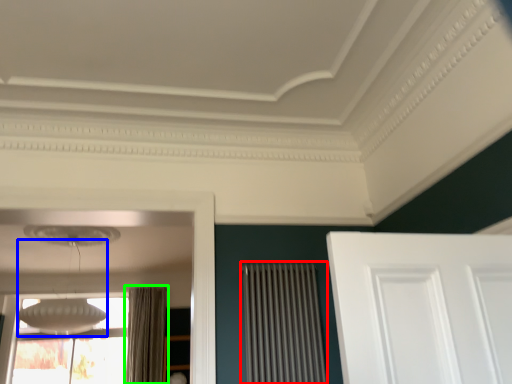
Question: Considering the real-world distances, which object is farthest from radiator (highlighted by a red box)? lamp (highlighted by a blue box) or curtain (highlighted by a green box)?

Choices:
 (A) lamp
 (B) curtain

Answer: (B)